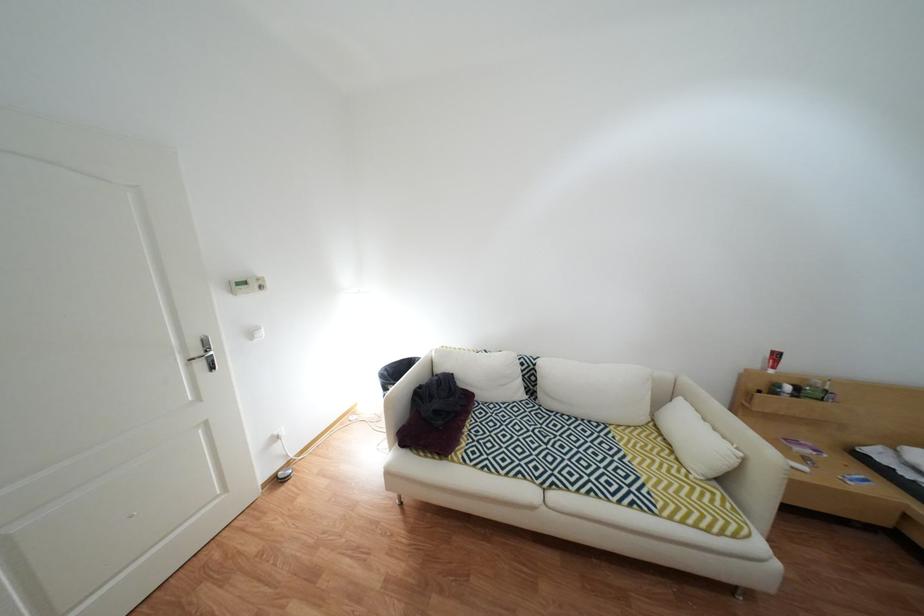
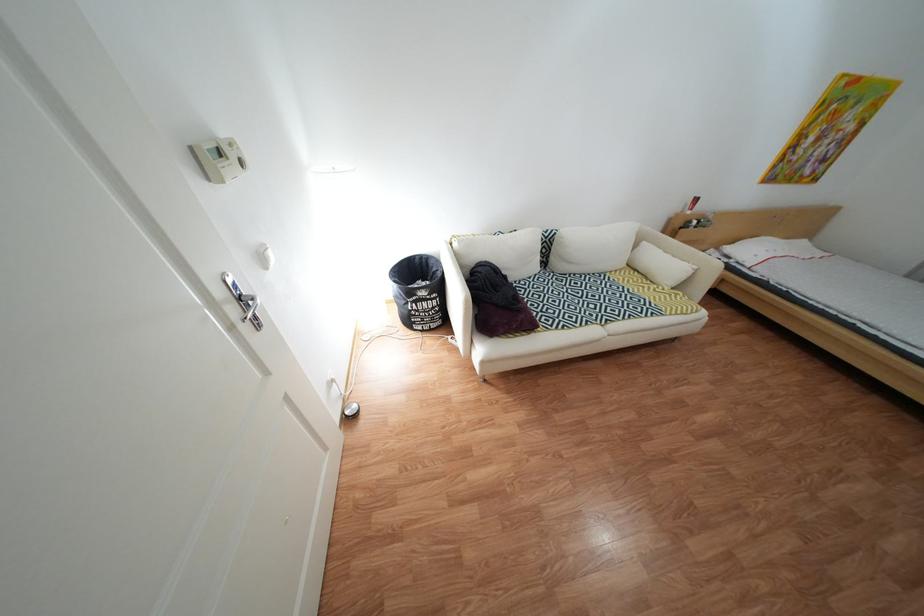
The point at (676, 436) is marked in the first image. Where is the corresponding point in the second image?

(651, 272)